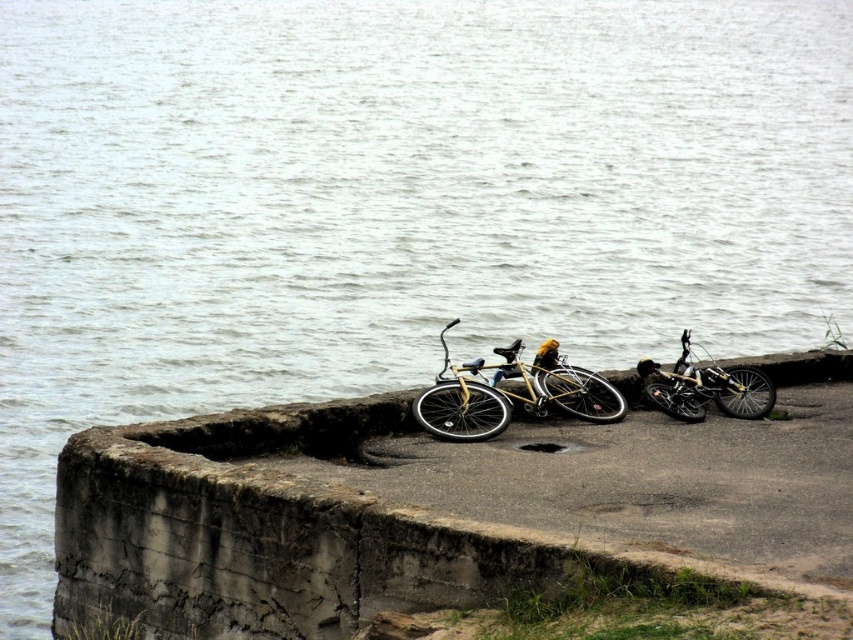
Is concrete at center to the left of shiny metallic bicycle at right from the viewer's perspective?

Indeed, concrete at center is positioned on the left side of shiny metallic bicycle at right.

Describe the element at coordinates (444, 512) in the screenshot. I see `concrete at center` at that location.

Identify the location of concrete at center. The image size is (853, 640). (444, 512).

Locate an element on the screen. yellow matte bicycle at center is located at coordinates (509, 396).

Does point (477, 403) come farther from viewer compared to point (730, 378)?

No, (477, 403) is closer to viewer.

This screenshot has width=853, height=640. I want to click on yellow matte bicycle at center, so click(509, 396).

Where is `concrete at center`? concrete at center is located at coordinates (444, 512).

Does point (660, 529) lie in front of point (486, 368)?

Yes.

What are the coordinates of `concrete at center` in the screenshot? It's located at 444,512.